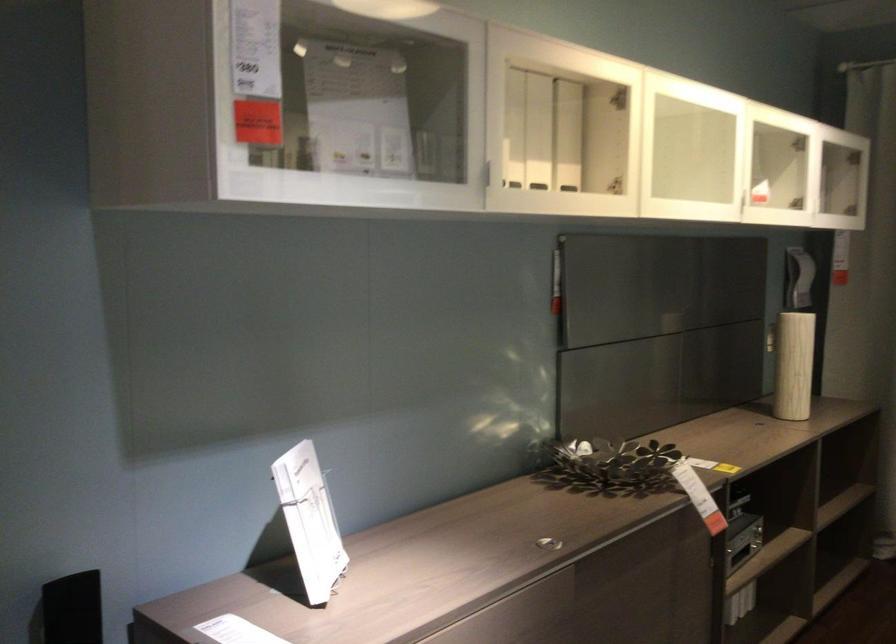
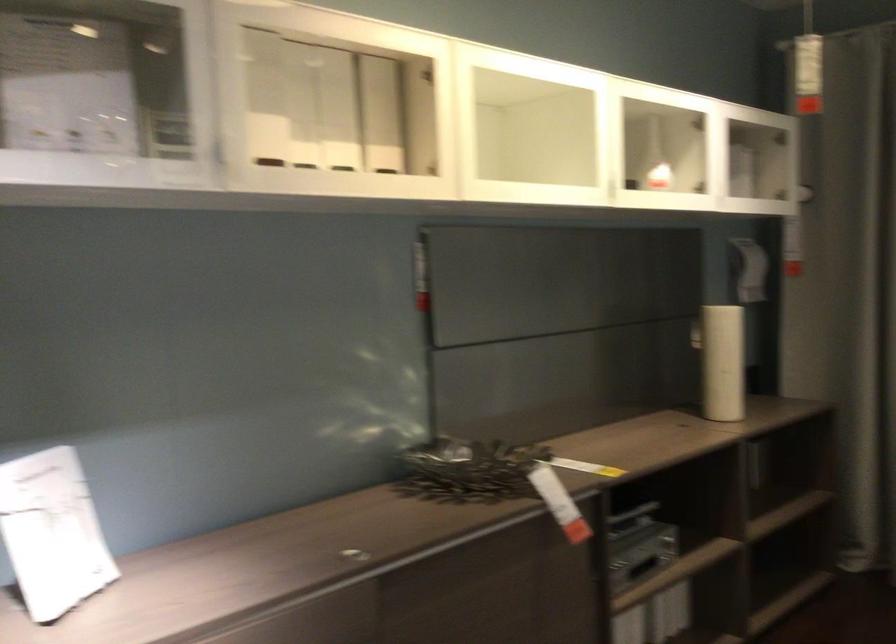
Question: In a continuous first-person perspective shot, in which direction is the camera moving?

Choices:
 (A) Left
 (B) Right
 (C) Forward
 (D) Backward

Answer: (B)